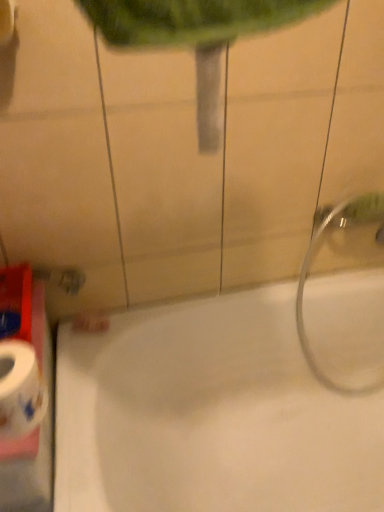
Question: From the image's perspective, is silver metallic showerhead at right beneath white glossy bathtub at lower right?

Choices:
 (A) yes
 (B) no

Answer: (B)

Question: Is silver metallic showerhead at right completely or partially outside of white glossy bathtub at lower right?

Choices:
 (A) no
 (B) yes

Answer: (A)

Question: Considering the relative sizes of silver metallic showerhead at right and white glossy bathtub at lower right in the image provided, is silver metallic showerhead at right wider than white glossy bathtub at lower right?

Choices:
 (A) no
 (B) yes

Answer: (A)

Question: Is white glossy bathtub at lower right at the back of silver metallic showerhead at right?

Choices:
 (A) no
 (B) yes

Answer: (B)

Question: Can you see silver metallic showerhead at right touching white glossy bathtub at lower right?

Choices:
 (A) yes
 (B) no

Answer: (B)

Question: Looking at the image, does white glossy toilet paper at lower left seem bigger or smaller compared to white glossy bathtub at lower right?

Choices:
 (A) small
 (B) big

Answer: (A)

Question: Looking at their shapes, would you say white glossy toilet paper at lower left is wider or thinner than white glossy bathtub at lower right?

Choices:
 (A) thin
 (B) wide

Answer: (A)

Question: Considering their positions, is white glossy toilet paper at lower left located in front of or behind white glossy bathtub at lower right?

Choices:
 (A) behind
 (B) front

Answer: (B)

Question: From the image's perspective, relative to white glossy bathtub at lower right, is white glossy toilet paper at lower left above or below?

Choices:
 (A) below
 (B) above

Answer: (B)

Question: Is white glossy bathtub at lower right inside the boundaries of silver metallic showerhead at right, or outside?

Choices:
 (A) inside
 (B) outside

Answer: (B)

Question: Considering the positions of white glossy bathtub at lower right and silver metallic showerhead at right in the image, is white glossy bathtub at lower right wider or thinner than silver metallic showerhead at right?

Choices:
 (A) wide
 (B) thin

Answer: (A)

Question: From the image's perspective, relative to silver metallic showerhead at right, is white glossy bathtub at lower right above or below?

Choices:
 (A) above
 (B) below

Answer: (B)

Question: In the image, is white glossy bathtub at lower right on the left side or the right side of silver metallic showerhead at right?

Choices:
 (A) right
 (B) left

Answer: (B)

Question: Considering the positions of silver metallic showerhead at right and white glossy bathtub at lower right in the image, is silver metallic showerhead at right wider or thinner than white glossy bathtub at lower right?

Choices:
 (A) thin
 (B) wide

Answer: (A)

Question: Relative to white glossy bathtub at lower right, is silver metallic showerhead at right in front or behind?

Choices:
 (A) front
 (B) behind

Answer: (B)